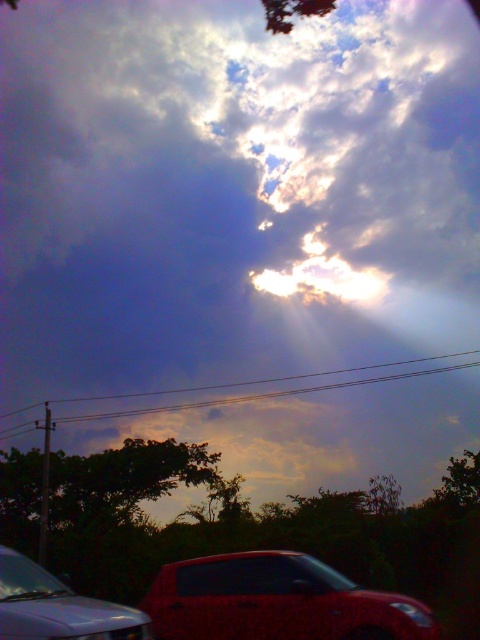
You are standing in the foreground of the scene, observing the dramatic sky and the glossy metallic car at lower center. Based on its position, can you determine if the car is closer to you or further away compared to the trees?

The glossy metallic car at lower center is located at point (276, 602), which places it closer to the observer than the trees in the foreground. Therefore, the car is closer to you than the trees.